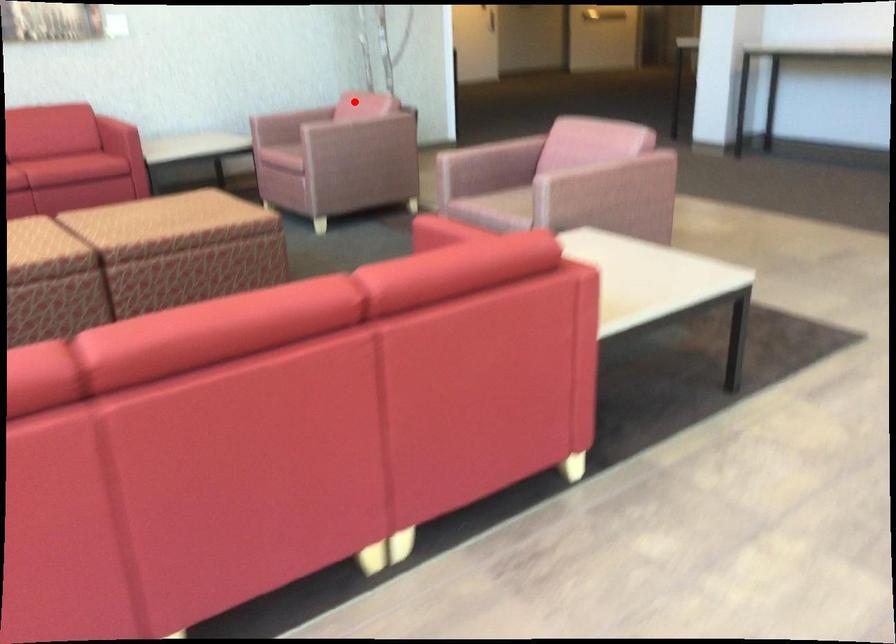
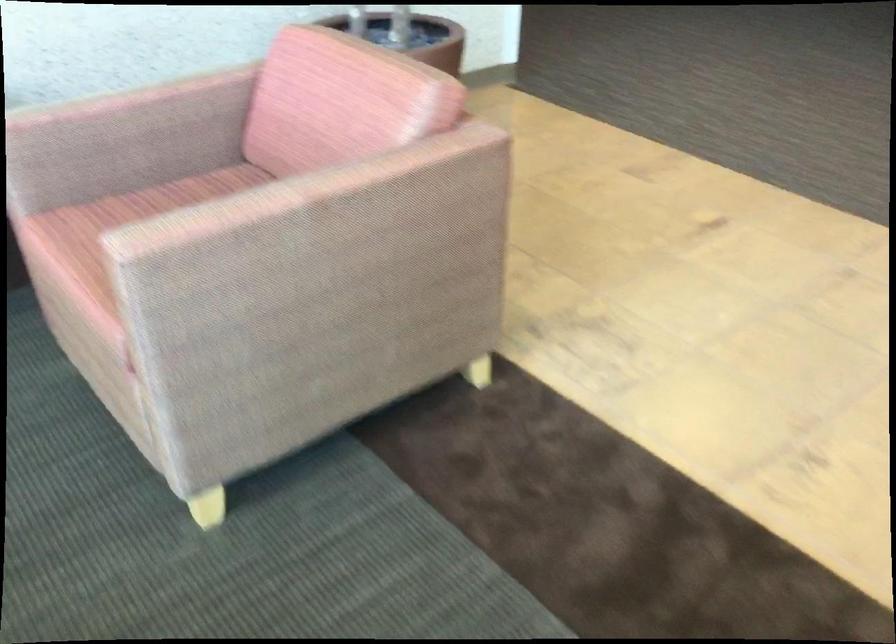
Question: I am providing you with two images of the same scene from different viewpoints. A red point is shown in image1. For the corresponding object point in image2, is it positioned nearer or farther from the camera?

Choices:
 (A) Nearer
 (B) Farther

Answer: (A)